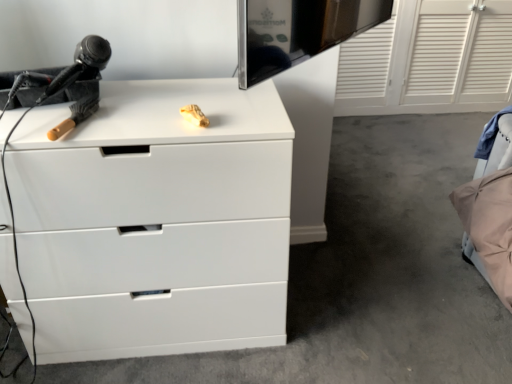
Question: Is beige fabric bed at lower right aimed at white matte chest of drawers at center?

Choices:
 (A) no
 (B) yes

Answer: (A)

Question: Does beige fabric bed at lower right appear on the right side of white matte chest of drawers at center?

Choices:
 (A) no
 (B) yes

Answer: (B)

Question: Are beige fabric bed at lower right and white matte chest of drawers at center far apart?

Choices:
 (A) yes
 (B) no

Answer: (B)

Question: Is beige fabric bed at lower right outside of white matte chest of drawers at center?

Choices:
 (A) no
 (B) yes

Answer: (B)

Question: From a real-world perspective, does beige fabric bed at lower right sit lower than white matte chest of drawers at center?

Choices:
 (A) no
 (B) yes

Answer: (B)

Question: Considering the relative sizes of beige fabric bed at lower right and white matte chest of drawers at center in the image provided, is beige fabric bed at lower right bigger than white matte chest of drawers at center?

Choices:
 (A) yes
 (B) no

Answer: (B)

Question: Does black plastic hairdryer at left lie in front of beige fabric bed at lower right?

Choices:
 (A) no
 (B) yes

Answer: (B)

Question: From a real-world perspective, is black plastic hairdryer at left physically below beige fabric bed at lower right?

Choices:
 (A) yes
 (B) no

Answer: (B)

Question: From the image's perspective, is black plastic hairdryer at left on top of beige fabric bed at lower right?

Choices:
 (A) no
 (B) yes

Answer: (B)

Question: Does black plastic hairdryer at left lie behind beige fabric bed at lower right?

Choices:
 (A) yes
 (B) no

Answer: (B)

Question: Is black plastic hairdryer at left shorter than beige fabric bed at lower right?

Choices:
 (A) no
 (B) yes

Answer: (B)

Question: Is black plastic hairdryer at left not within beige fabric bed at lower right?

Choices:
 (A) yes
 (B) no

Answer: (A)

Question: Is black plastic hairdryer at left outside of white matte chest of drawers at center?

Choices:
 (A) yes
 (B) no

Answer: (A)